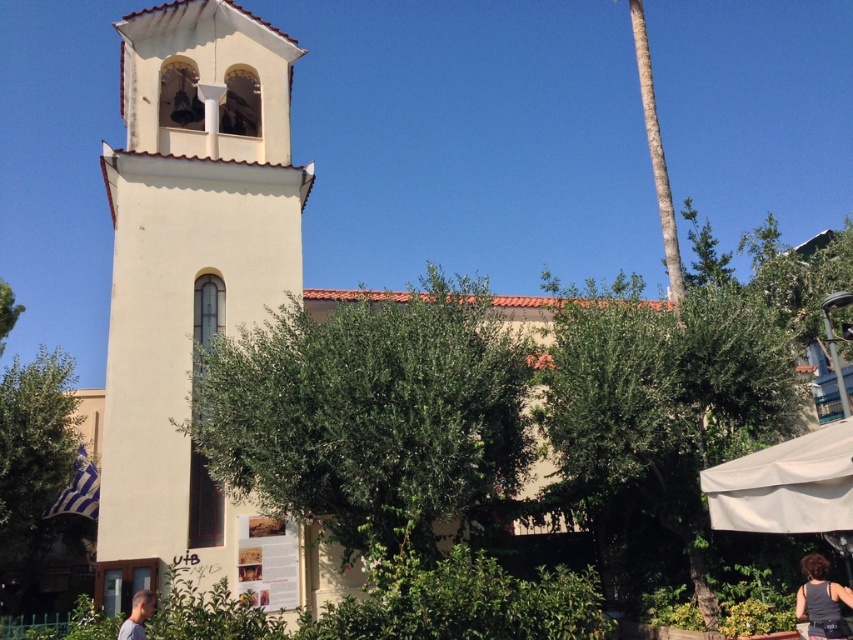
You are a photographer trying to capture the bell tower in the background without any obstructions. You notice the green textured palm tree at upper right and the blonde hair at lower left. Which object is taller and might block your view of the bell tower?

The green textured palm tree at upper right is taller than the blonde hair at lower left, so it might block your view of the bell tower.

You are a photographer standing in front of the white stucco church at center and the black fabric tank top at lower right. You want to capture a photo where both objects are visible in the frame. Which object should you focus on to ensure both are in the frame?

You should focus on the white stucco church at center because it is taller than the black fabric tank top at lower right, so keeping it centered will help include both in the frame.

You are standing in front of the building with the bell tower and want to take a photo. You notice two points marked in the scene. Which point is closer to your camera? The points are point 1 at coordinates point (274, 296) and point 2 at coordinates point (776, 525). Please answer based on the spatial relationship between them.

Point 1 at coordinates point (274, 296) is closer to the camera because it is further to the camera than point 2 at coordinates point (776, 525).